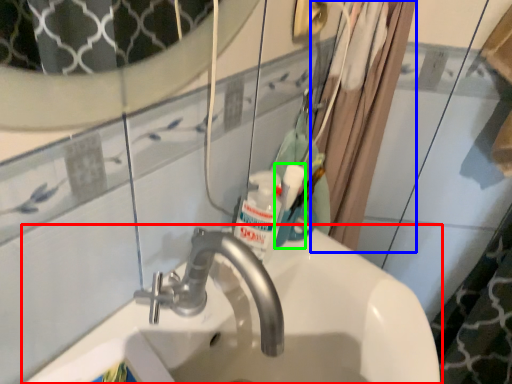
Question: Estimate the real-world distances between objects in this image. Which object is farther from sink (highlighted by a red box), shower curtain (highlighted by a blue box) or mouthwash (highlighted by a green box)?

Choices:
 (A) shower curtain
 (B) mouthwash

Answer: (A)